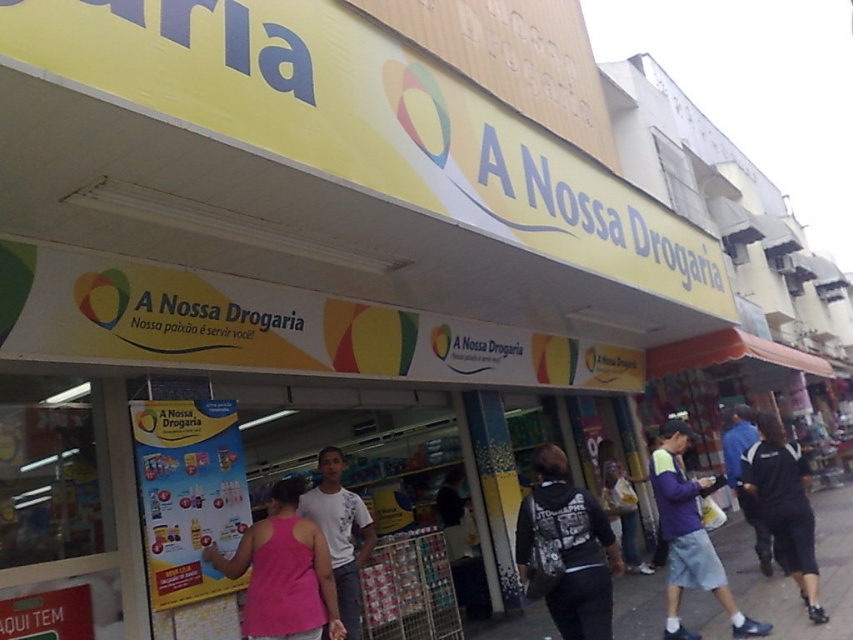
In the scene shown: You are standing outside the pharmacy and see a black cotton shirt at lower right and a dark blue jacket at center. Which clothing item is shorter in height?

The black cotton shirt at lower right is shorter in height compared to the dark blue jacket at center.

You are a customer entering the pharmacy and see the black cotton shirt at lower right and the dark blue jacket at center. Which item is positioned higher on the rack?

The black cotton shirt at lower right is above the dark blue jacket at center, so the black cotton shirt at lower right is positioned higher on the rack.